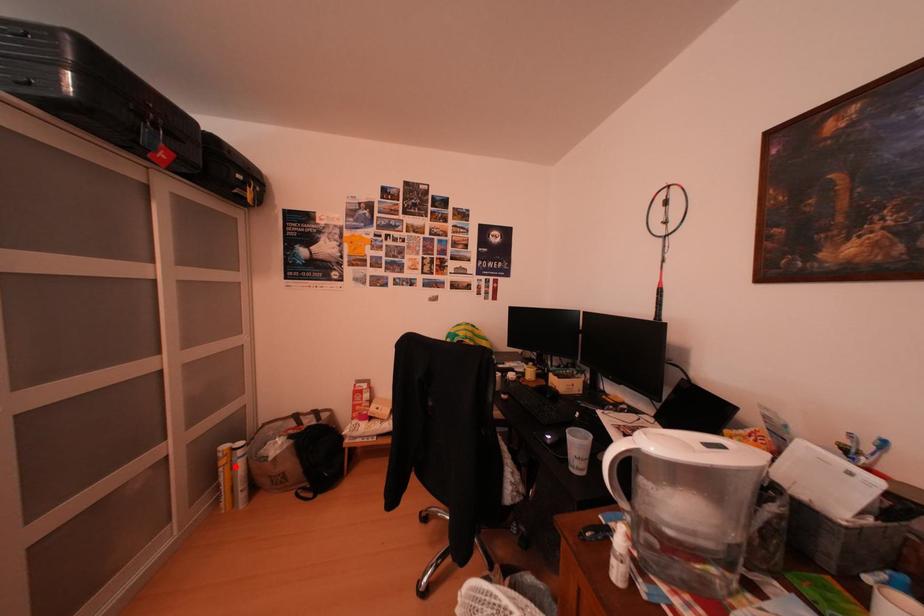
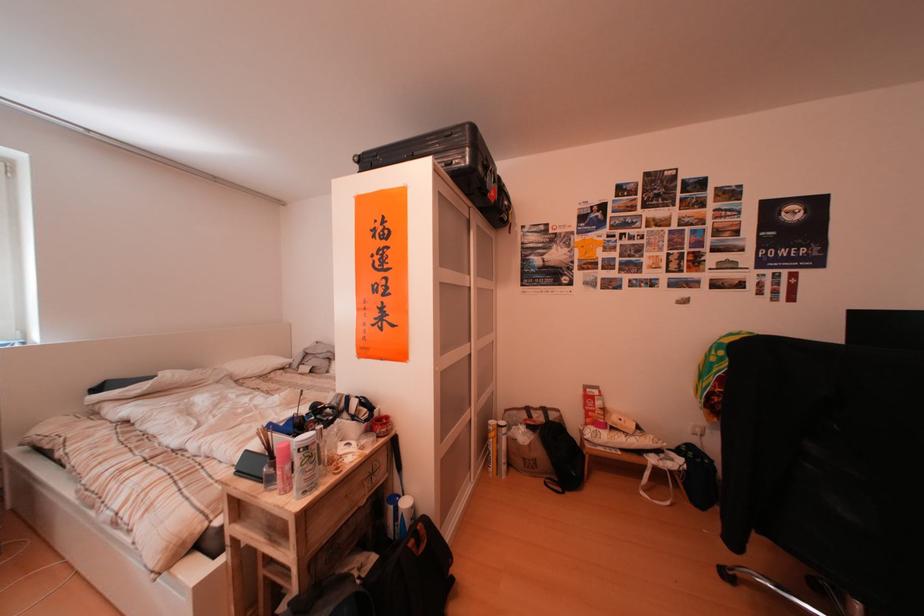
Question: I am providing you with two images of the same scene from different viewpoints. In image1, a red point is highlighted. Considering the same 3D point in image2, which of the following is correct?

Choices:
 (A) It is closer
 (B) It is farther

Answer: (B)